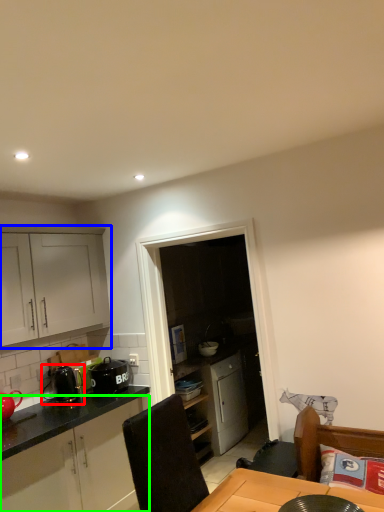
Question: Based on their relative distances, which object is nearer to appliance (highlighted by a red box)? Choose from cabinetry (highlighted by a blue box) and cabinetry (highlighted by a green box).

Choices:
 (A) cabinetry
 (B) cabinetry

Answer: (B)